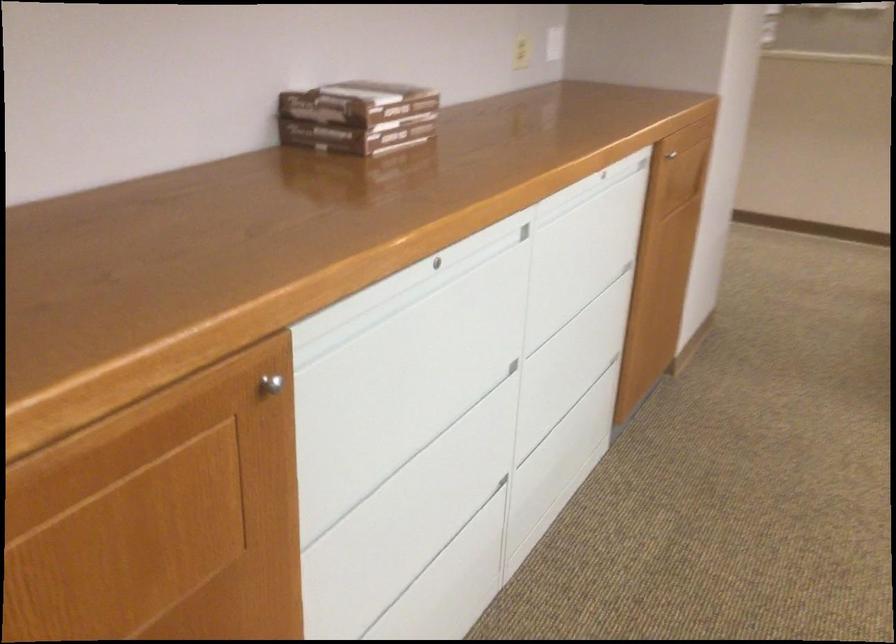
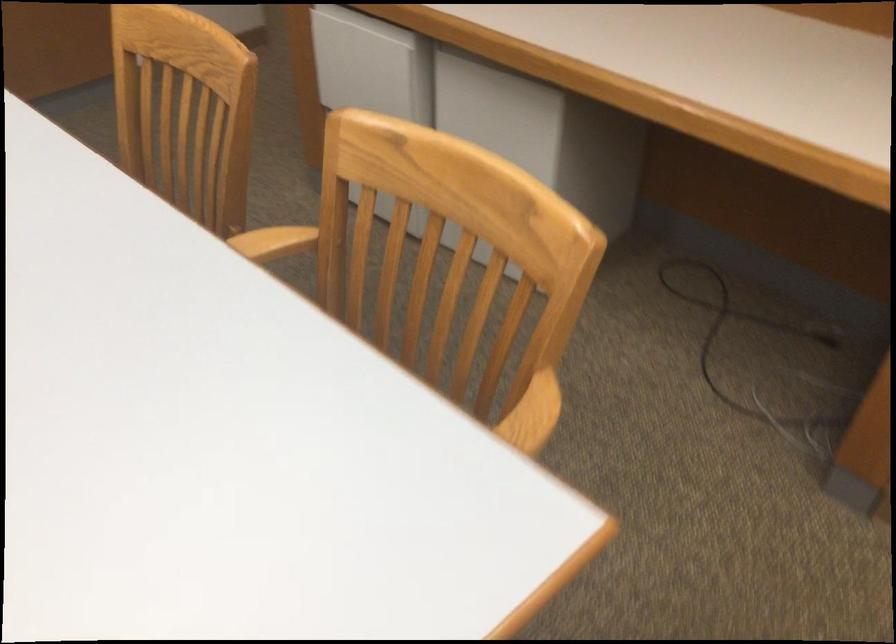
Question: The images are taken continuously from a first-person perspective. In which direction are you moving?

Choices:
 (A) Left
 (B) Right
 (C) Forward
 (D) Backward

Answer: (B)